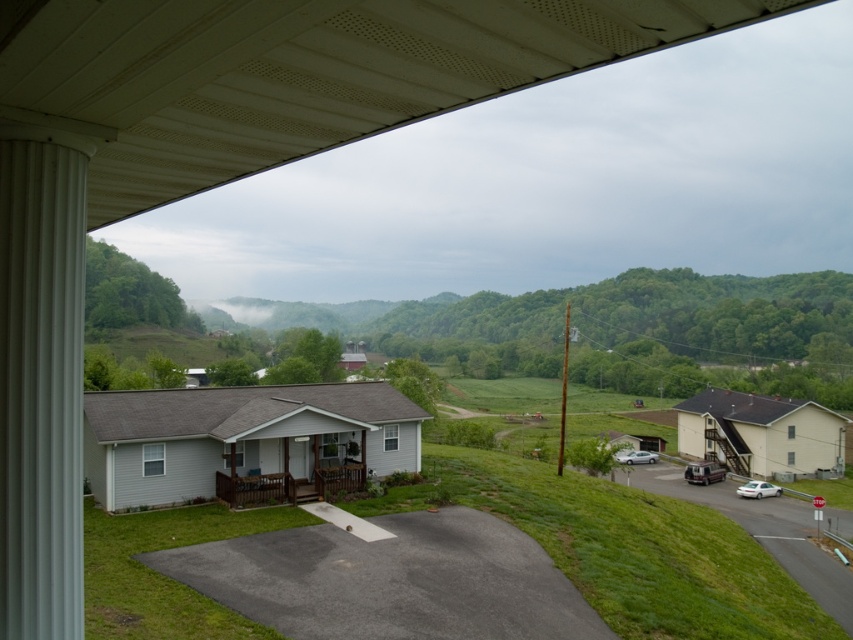
Can you confirm if brown wooden porch at lower center is positioned to the left of metallic silver van at lower right?

Correct, you'll find brown wooden porch at lower center to the left of metallic silver van at lower right.

Between brown wooden porch at lower center and metallic silver van at lower right, which one is positioned lower?

metallic silver van at lower right is below.

Does point (235, 499) come farther from viewer compared to point (700, 461)?

No, (235, 499) is in front of (700, 461).

The image size is (853, 640). What are the coordinates of `brown wooden porch at lower center` in the screenshot? It's located at (289, 486).

Which of these two, white glossy sedan at lower right or silver metallic sedan at lower right, stands shorter?

white glossy sedan at lower right is shorter.

Can you confirm if white glossy sedan at lower right is thinner than silver metallic sedan at lower right?

Yes.

Is point (772, 493) closer to camera compared to point (621, 458)?

Yes, point (772, 493) is closer to viewer.

This screenshot has height=640, width=853. What are the coordinates of `white glossy sedan at lower right` in the screenshot? It's located at (758, 490).

Can you confirm if metallic silver van at lower right is smaller than silver metallic sedan at lower right?

No, metallic silver van at lower right is not smaller than silver metallic sedan at lower right.

Does metallic silver van at lower right come in front of silver metallic sedan at lower right?

Yes, it is in front of silver metallic sedan at lower right.

Does point (717, 477) come in front of point (637, 458)?

Yes, it is in front of point (637, 458).

Find the location of a particular element. metallic silver van at lower right is located at coordinates (704, 472).